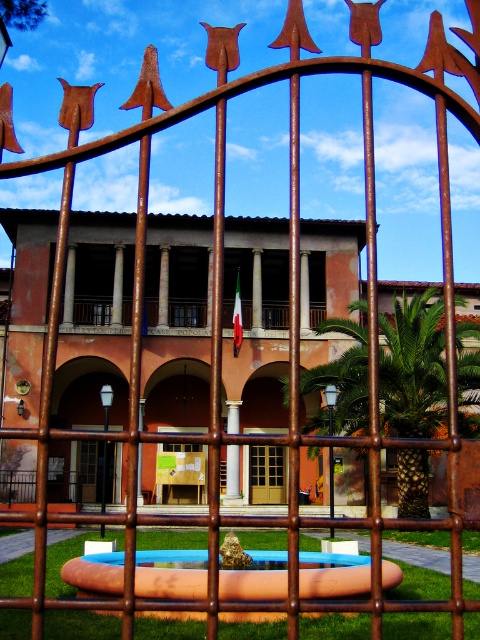
Where is `blue plastic pool at center`? Image resolution: width=480 pixels, height=640 pixels. blue plastic pool at center is located at coordinates (170, 573).

Who is positioned more to the left, blue plastic pool at center or brown polished stone pillar at center?

brown polished stone pillar at center

Does point (342, 579) lie behind point (237, 474)?

No, (342, 579) is in front of (237, 474).

Image resolution: width=480 pixels, height=640 pixels. In order to click on blue plastic pool at center in this screenshot , I will do `click(170, 573)`.

Can you confirm if blue plastic pool at center is shorter than brown wooden door at center?

In fact, blue plastic pool at center may be taller than brown wooden door at center.

Consider the image. Can you confirm if blue plastic pool at center is positioned above brown wooden door at center?

Yes.

Where is `blue plastic pool at center`? blue plastic pool at center is located at coordinates (170, 573).

Does point (280, 499) come farther from viewer compared to point (229, 445)?

That is True.

Between point (267, 477) and point (227, 465), which one is positioned in front?

Positioned in front is point (227, 465).

I want to click on brown wooden door at center, so click(266, 474).